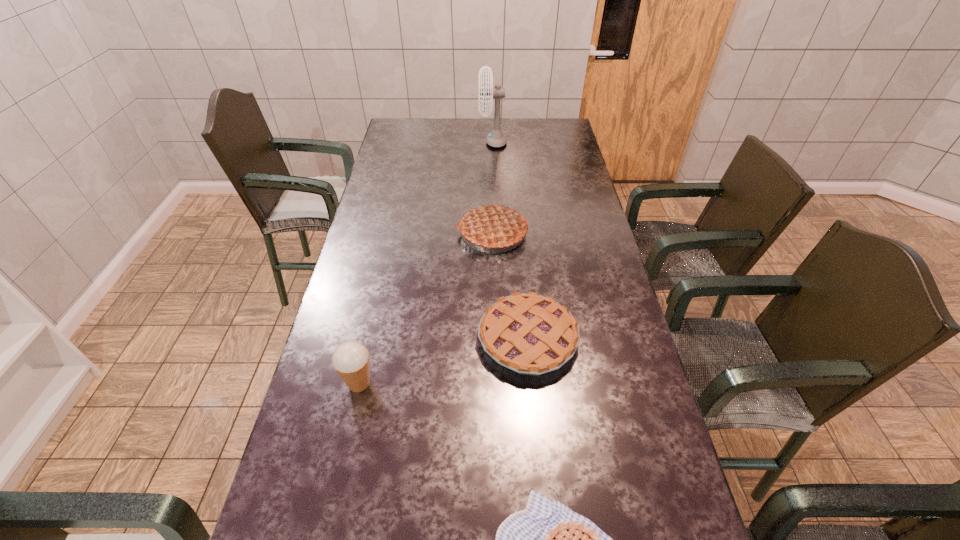
Where is `free space between the second shortest pie and the tallest pie`? This screenshot has width=960, height=540. free space between the second shortest pie and the tallest pie is located at coordinates (510, 286).

At what (x,y) coordinates should I click in order to perform the action: click on free space that is in between the second shortest pie and the third shortest object. Please return your answer as a coordinate pair (x, y). Looking at the image, I should click on (444, 361).

Find the location of a particular element. free space that is in between the farthest object and the third shortest object is located at coordinates (426, 262).

Identify the location of vacant space that's between the icecream and the farthest pie. The image size is (960, 540). (425, 308).

Where is `the third closest object relative to the nearest object`? the third closest object relative to the nearest object is located at coordinates (493, 226).

This screenshot has width=960, height=540. Find the location of `object that is the fourth closest to the farthest pie`. object that is the fourth closest to the farthest pie is located at coordinates (547, 539).

Find the location of a particular element. This screenshot has width=960, height=540. the closest pie to the second farthest pie is located at coordinates (493, 226).

What are the coordinates of `pie that can be found as the second closest to the nearest object` in the screenshot? It's located at (493, 226).

Locate an element on the screen. free location that satisfies the following two spatial constraints: 1. on the front-facing side of the second farthest pie; 2. on the left side of the fan is located at coordinates (501, 339).

The width and height of the screenshot is (960, 540). I want to click on vacant area that satisfies the following two spatial constraints: 1. on the front-facing side of the second nearest pie; 2. on the left side of the farthest object, so click(501, 339).